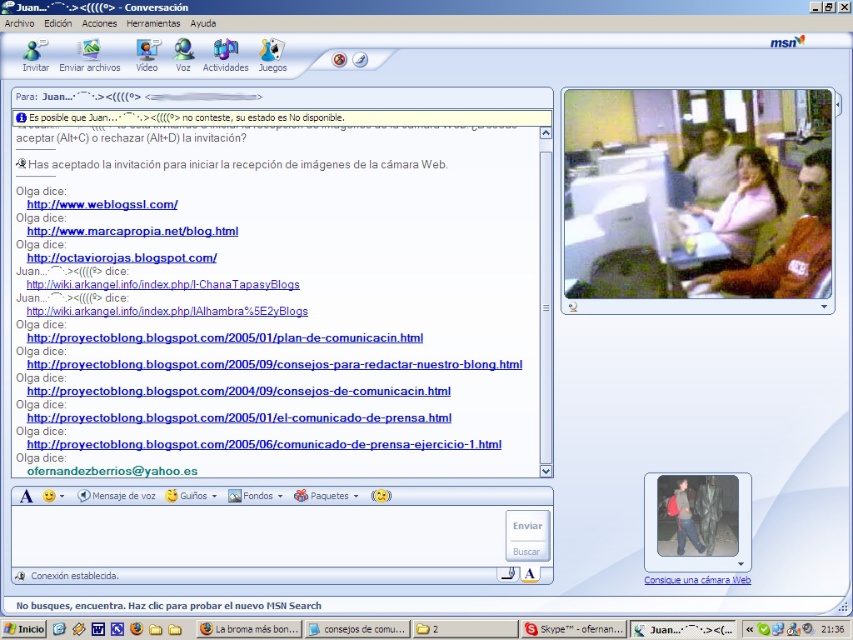
Which is more to the left, white matte shirt at upper center or white glossy text at bottom center?

white glossy text at bottom center

Does white matte shirt at upper center appear on the right side of white glossy text at bottom center?

Yes, white matte shirt at upper center is to the right of white glossy text at bottom center.

The image size is (853, 640). Identify the location of white matte shirt at upper center. (712, 168).

Is pink fabric shirt at upper right shorter than camouflage pants at lower right?

Incorrect, pink fabric shirt at upper right's height does not fall short of camouflage pants at lower right's.

Which of these two, pink fabric shirt at upper right or camouflage pants at lower right, stands taller?

With more height is pink fabric shirt at upper right.

Is point (746, 168) less distant than point (698, 499)?

Yes, it is in front of point (698, 499).

The width and height of the screenshot is (853, 640). What are the coordinates of `pink fabric shirt at upper right` in the screenshot? It's located at (744, 208).

Between point (683, 518) and point (698, 582), which one is positioned behind?

The point (683, 518) is behind.

In the scene shown: Who is more forward, (694, 544) or (703, 580)?

Point (703, 580) is more forward.

Is point (679, 502) closer to camera compared to point (650, 576)?

No, it is behind (650, 576).

What are the coordinates of `matte black jacket at center` in the screenshot? It's located at [683, 516].